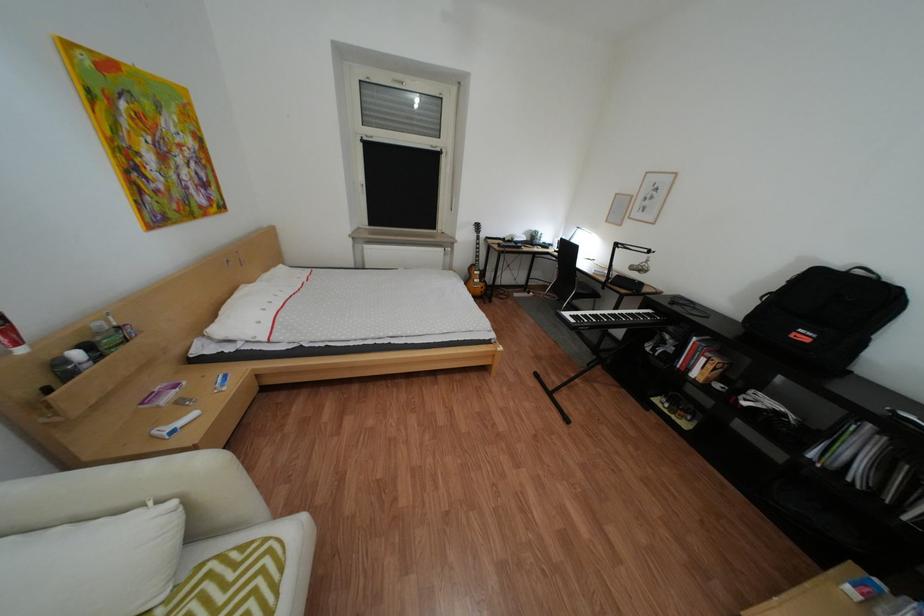
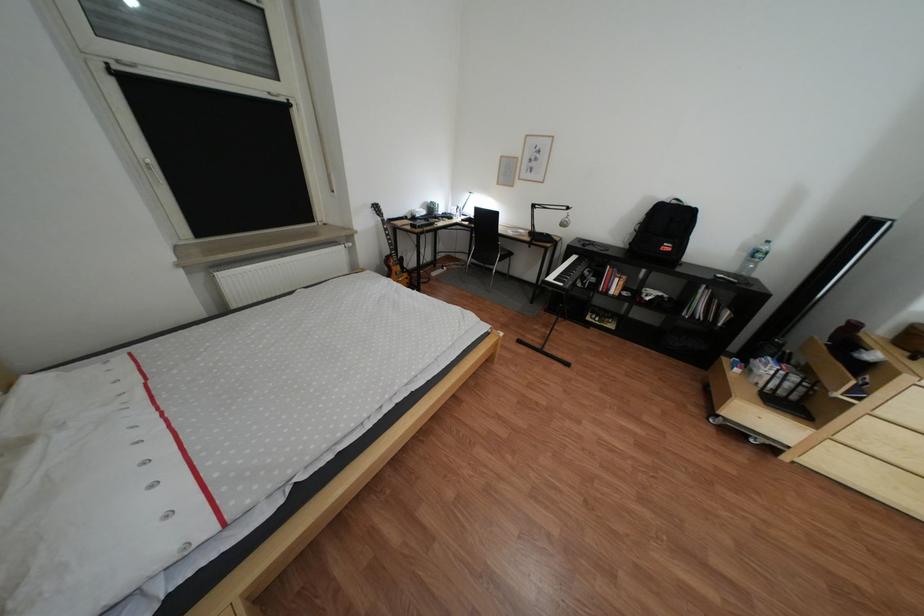
In the second image, find the point that corresponds to point 687,304 in the first image.

(600, 246)